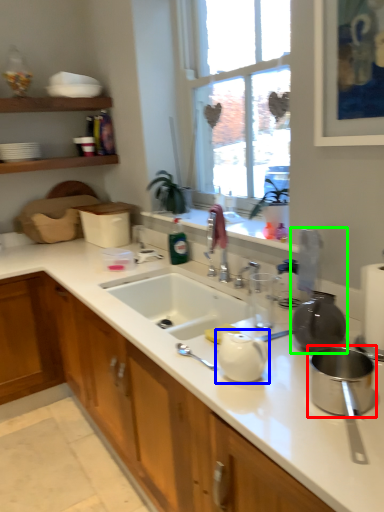
Question: Based on their relative distances, which object is nearer to appliance (highlighted by a red box)? Choose from tea pot (highlighted by a blue box) and appliance (highlighted by a green box).

Choices:
 (A) tea pot
 (B) appliance

Answer: (B)